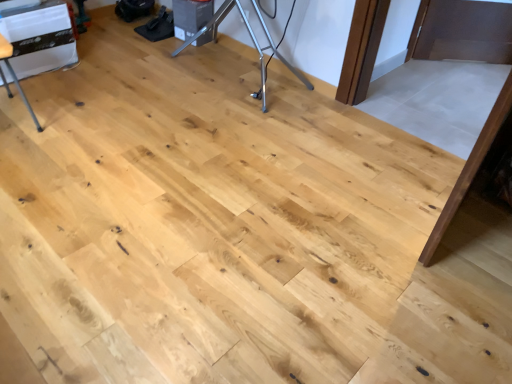
Question: From a real-world perspective, is white plastic table at upper left beneath silver metallic tripod at center?

Choices:
 (A) no
 (B) yes

Answer: (A)

Question: Considering the relative sizes of white plastic table at upper left and silver metallic tripod at center in the image provided, is white plastic table at upper left thinner than silver metallic tripod at center?

Choices:
 (A) no
 (B) yes

Answer: (A)

Question: Can you confirm if white plastic table at upper left is positioned to the right of silver metallic tripod at center?

Choices:
 (A) no
 (B) yes

Answer: (A)

Question: Is white plastic table at upper left wider than silver metallic tripod at center?

Choices:
 (A) no
 (B) yes

Answer: (B)

Question: Is white plastic table at upper left positioned far away from silver metallic tripod at center?

Choices:
 (A) no
 (B) yes

Answer: (A)

Question: Is white plastic table at upper left to the left of silver metallic tripod at center from the viewer's perspective?

Choices:
 (A) no
 (B) yes

Answer: (B)

Question: From a real-world perspective, is silver metallic tripod at center below white plastic table at upper left?

Choices:
 (A) yes
 (B) no

Answer: (A)

Question: Considering the relative positions of silver metallic tripod at center and white plastic table at upper left in the image provided, is silver metallic tripod at center to the right of white plastic table at upper left from the viewer's perspective?

Choices:
 (A) no
 (B) yes

Answer: (B)

Question: From the image's perspective, does silver metallic tripod at center appear higher than white plastic table at upper left?

Choices:
 (A) yes
 (B) no

Answer: (A)

Question: Considering the relative sizes of silver metallic tripod at center and white plastic table at upper left in the image provided, is silver metallic tripod at center taller than white plastic table at upper left?

Choices:
 (A) no
 (B) yes

Answer: (A)

Question: Would you consider silver metallic tripod at center to be distant from white plastic table at upper left?

Choices:
 (A) yes
 (B) no

Answer: (B)

Question: Is silver metallic tripod at center to the left of white plastic table at upper left from the viewer's perspective?

Choices:
 (A) yes
 (B) no

Answer: (B)

Question: Is silver metallic tripod at center touching matte white appliance at left?

Choices:
 (A) yes
 (B) no

Answer: (B)